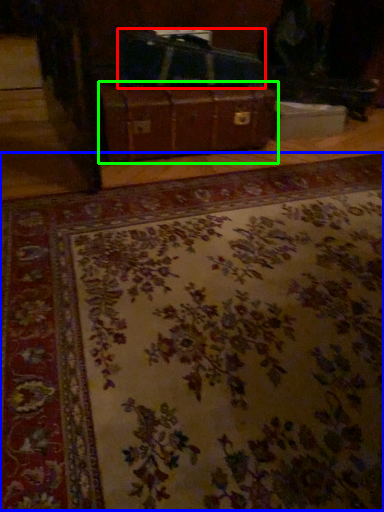
Question: Based on their relative distances, which object is farther from luggage (highlighted by a red box)? Choose from mat (highlighted by a blue box) and suitcase (highlighted by a green box).

Choices:
 (A) mat
 (B) suitcase

Answer: (A)